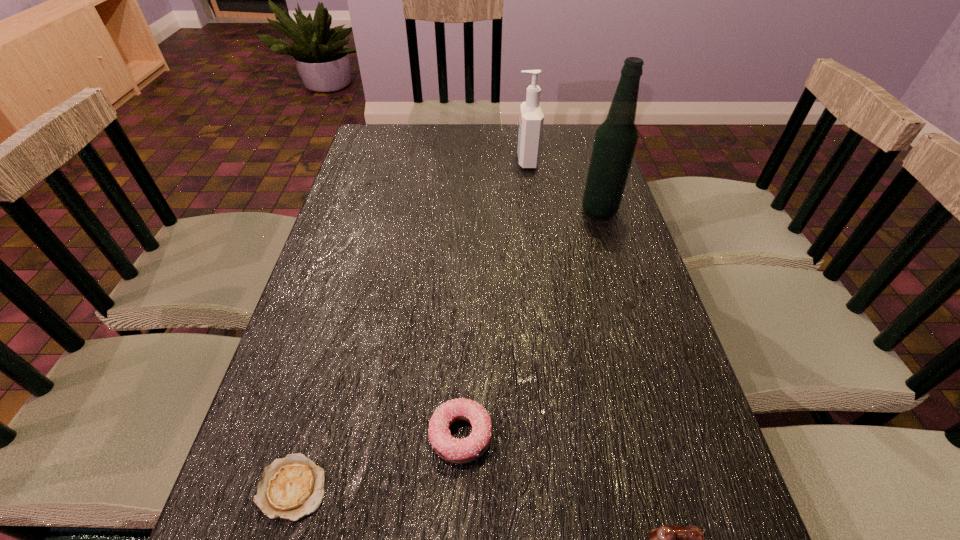
I want to click on blank space located on the front label of the second tallest object, so click(485, 160).

Locate an element on the screen. This screenshot has height=540, width=960. vacant space located 0.290m on the front label of the second tallest object is located at coordinates pyautogui.click(x=427, y=160).

At what (x,y) coordinates should I click in order to perform the action: click on free region located 0.070m on the right of the doughnut. Please return your answer as a coordinate pair (x, y). This screenshot has width=960, height=540. Looking at the image, I should click on (531, 435).

You are a GUI agent. You are given a task and a screenshot of the screen. Output one action in this format:
    pyautogui.click(x=<x>, y=<y>)
    Task: Click on the vacant space situated on the right of the leftmost object
    The height and width of the screenshot is (540, 960).
    Given the screenshot: What is the action you would take?
    pyautogui.click(x=540, y=487)

You are a GUI agent. You are given a task and a screenshot of the screen. Output one action in this format:
    pyautogui.click(x=<x>, y=<y>)
    Task: Click on the object positioned at the far edge
    This screenshot has width=960, height=540.
    Given the screenshot: What is the action you would take?
    (531, 120)

I want to click on object at the left edge, so click(x=292, y=487).

This screenshot has height=540, width=960. I want to click on object positioned at the right edge, so click(616, 138).

I want to click on free space at the far edge of the desktop, so click(510, 131).

Identify the location of vacant space at the left edge. (262, 412).

In the image, there is a desktop. Find the location of `vacant region at the right edge`. vacant region at the right edge is located at coordinates (650, 341).